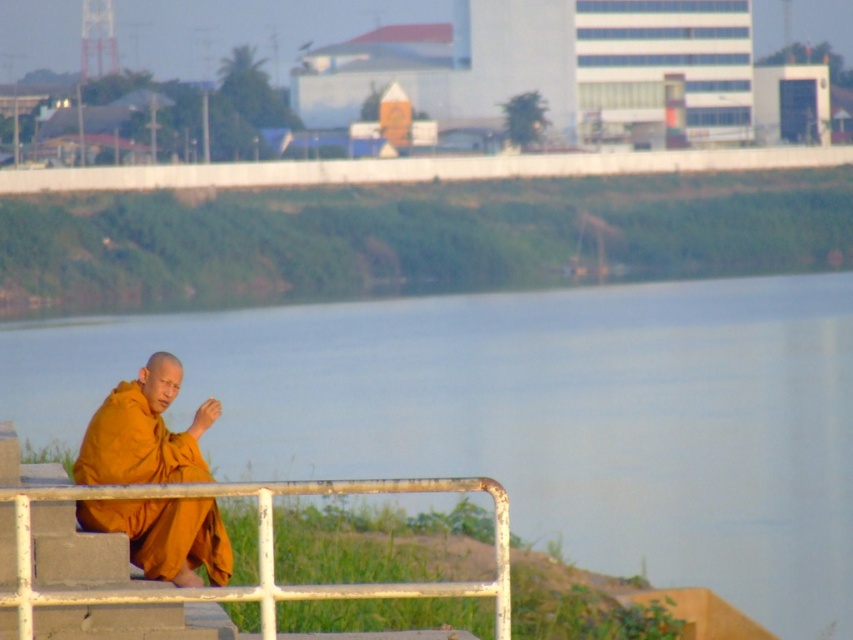
Question: Which object appears closest to the camera in this image?

Choices:
 (A) blue water at center
 (B) matte orange robe at lower left

Answer: (A)

Question: Considering the relative positions of blue water at center and matte orange robe at lower left in the image provided, where is blue water at center located with respect to matte orange robe at lower left?

Choices:
 (A) right
 (B) left

Answer: (B)

Question: Is matte orange robe at lower left wider than white metal rail at lower center?

Choices:
 (A) no
 (B) yes

Answer: (A)

Question: Which is nearer to the matte orange robe at lower left?

Choices:
 (A) white metal rail at lower center
 (B) blue water at center

Answer: (A)

Question: From the image, what is the correct spatial relationship of blue water at center in relation to white metal rail at lower center?

Choices:
 (A) left
 (B) right

Answer: (A)

Question: Which object is the farthest from the matte orange robe at lower left?

Choices:
 (A) blue water at center
 (B) white metal rail at lower center

Answer: (A)